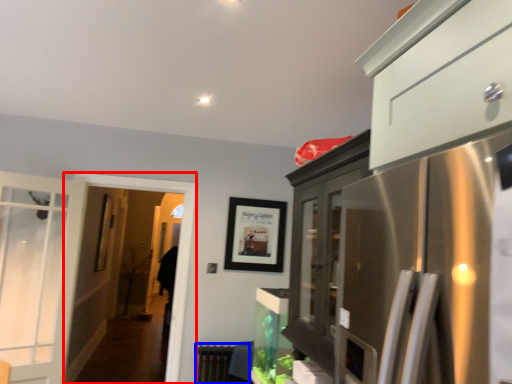
Question: Which object appears closest to the camera in this image, screen door (highlighted by a red box) or radiator (highlighted by a blue box)?

Choices:
 (A) screen door
 (B) radiator

Answer: (A)